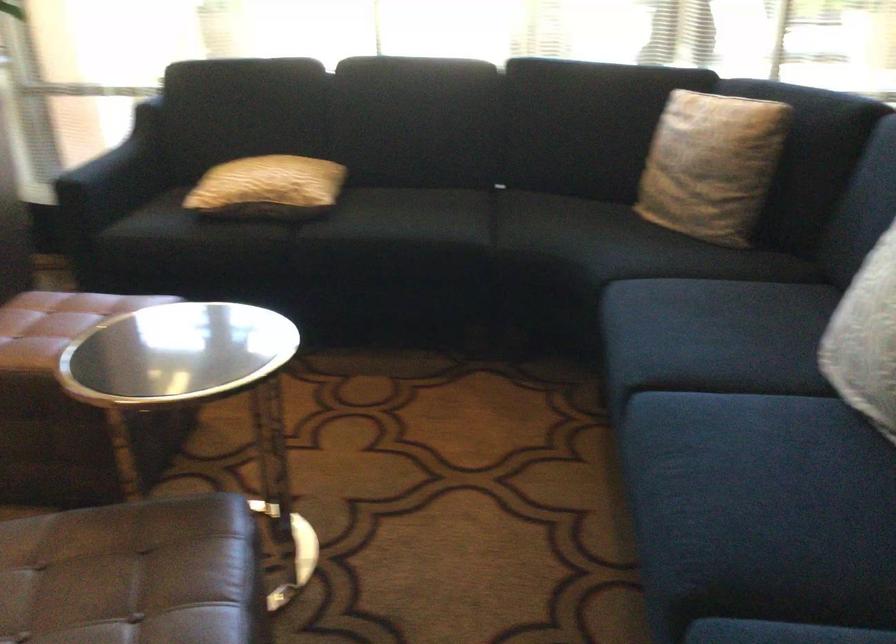
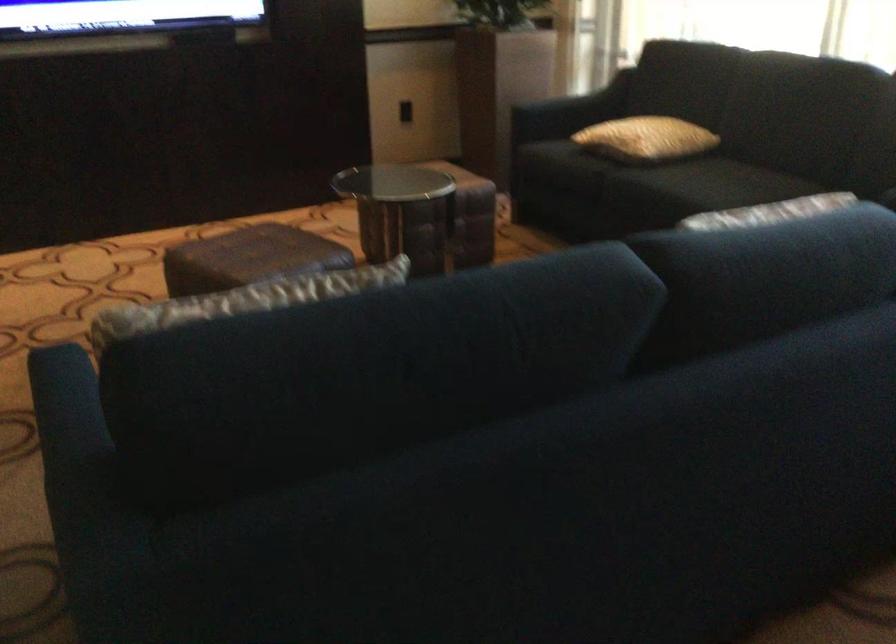
Locate, in the second image, the point that corresponds to point 426,218 in the first image.

(709, 184)